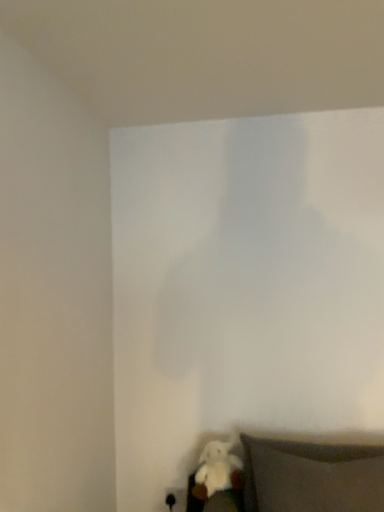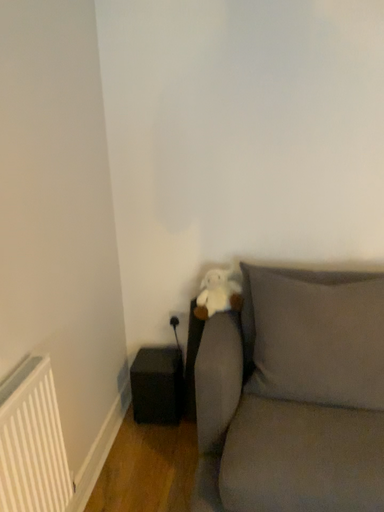
Question: How did the camera likely rotate when shooting the video?

Choices:
 (A) rotated downward
 (B) rotated upward

Answer: (A)